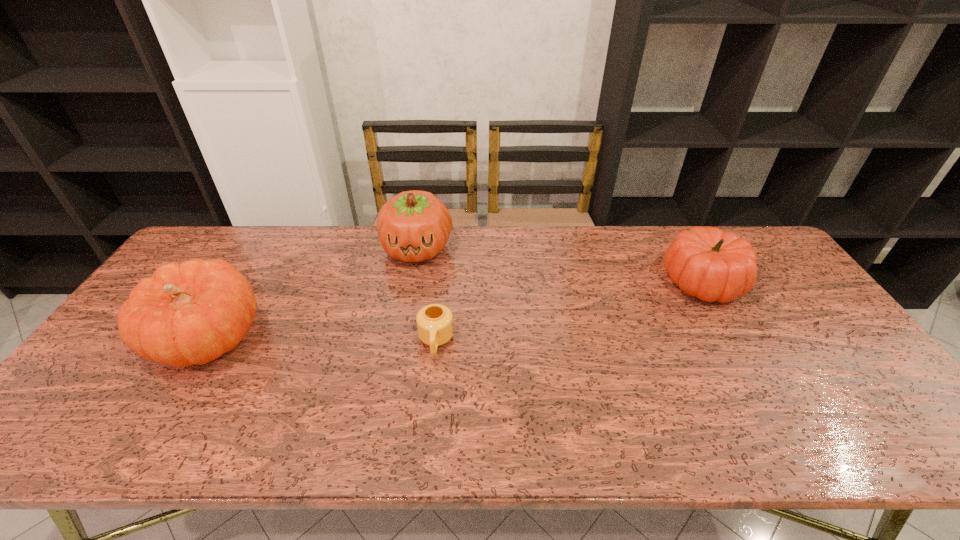
The image size is (960, 540). Find the location of `the second pumpkin from right to left`. the second pumpkin from right to left is located at coordinates (413, 226).

Where is `the leftmost pumpkin`? the leftmost pumpkin is located at coordinates (191, 313).

Where is `the shortest pumpkin`? The width and height of the screenshot is (960, 540). the shortest pumpkin is located at coordinates (707, 263).

The image size is (960, 540). I want to click on the second shortest object, so click(x=707, y=263).

Where is `mug`? Image resolution: width=960 pixels, height=540 pixels. mug is located at coordinates (434, 322).

At what (x,y) coordinates should I click in order to perform the action: click on free space located on the side of the second pumpkin from right to left with the cute face. Please return your answer as a coordinate pair (x, y). Looking at the image, I should click on (402, 330).

At what (x,y) coordinates should I click in order to perform the action: click on free point located on the right of the leftmost pumpkin. Please return your answer as a coordinate pair (x, y). The image size is (960, 540). Looking at the image, I should click on (374, 340).

The image size is (960, 540). Identify the location of vacant point located 0.300m on the left of the rightmost object. (565, 282).

You are a GUI agent. You are given a task and a screenshot of the screen. Output one action in this format:
    pyautogui.click(x=<x>, y=<y>)
    Task: Click on the vacant region located on the handle side of the shortest object
    The image size is (960, 540).
    Given the screenshot: What is the action you would take?
    pyautogui.click(x=427, y=432)

Image resolution: width=960 pixels, height=540 pixels. I want to click on object that is at the left edge, so click(191, 313).